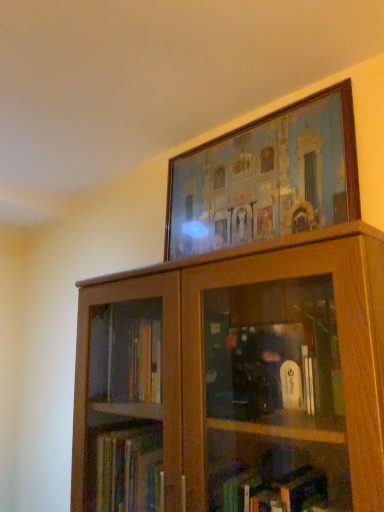
Question: Is wooden picture frame at upper center situated inside wooden cabinet at upper center or outside?

Choices:
 (A) outside
 (B) inside

Answer: (A)

Question: Is point (190, 237) closer or farther from the camera than point (253, 292)?

Choices:
 (A) closer
 (B) farther

Answer: (B)

Question: From the image's perspective, is wooden picture frame at upper center positioned above or below wooden cabinet at upper center?

Choices:
 (A) above
 (B) below

Answer: (A)

Question: Does point (183, 433) appear closer or farther from the camera than point (173, 180)?

Choices:
 (A) closer
 (B) farther

Answer: (A)

Question: In the image, is wooden cabinet at upper center positioned in front of or behind wooden picture frame at upper center?

Choices:
 (A) behind
 (B) front

Answer: (B)

Question: Visually, is wooden cabinet at upper center positioned to the left or to the right of wooden picture frame at upper center?

Choices:
 (A) left
 (B) right

Answer: (A)

Question: From the image's perspective, is wooden cabinet at upper center positioned above or below wooden picture frame at upper center?

Choices:
 (A) above
 (B) below

Answer: (B)